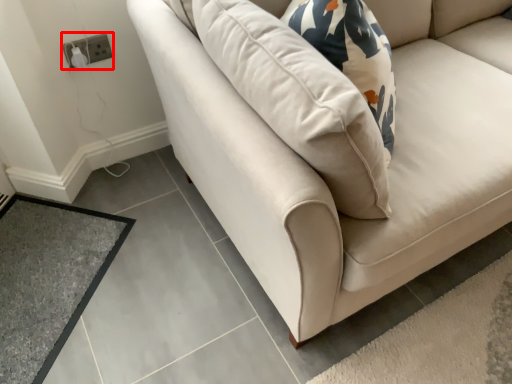
Question: In this image, where is electric outlet (annotated by the red box) located relative to mat?

Choices:
 (A) left
 (B) right

Answer: (B)